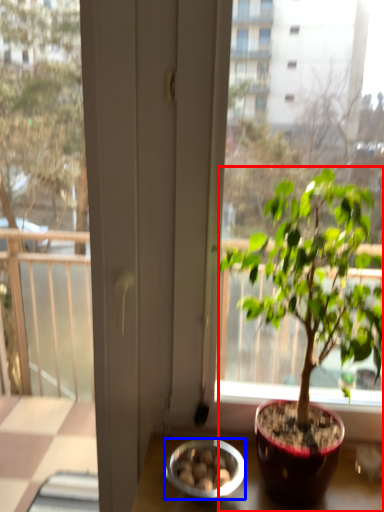
Question: Which object appears closest to the camera in this image, houseplant (highlighted by a red box) or bowl (highlighted by a blue box)?

Choices:
 (A) houseplant
 (B) bowl

Answer: (A)